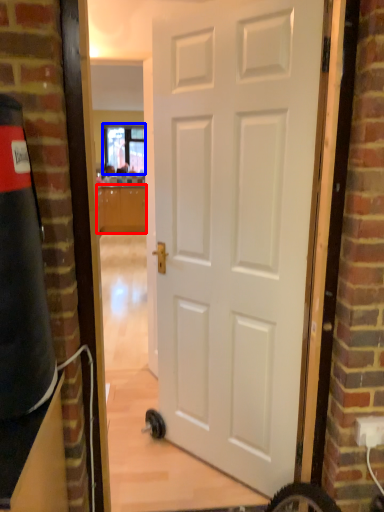
Question: Which point is further to the camera, cabinetry (highlighted by a red box) or window (highlighted by a blue box)?

Choices:
 (A) cabinetry
 (B) window

Answer: (B)